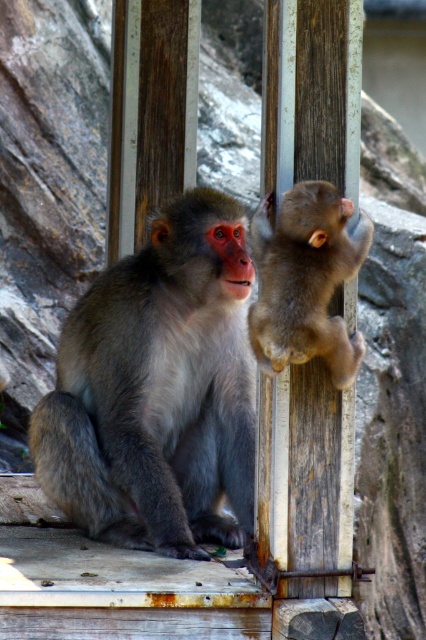
Question: Which point is farther to the camera?

Choices:
 (A) coord(74,506)
 (B) coord(308,275)

Answer: (A)

Question: Is gray fur monkey at center wider than brown furry monkey at upper right?

Choices:
 (A) no
 (B) yes

Answer: (B)

Question: Which of the following is the farthest from the observer?

Choices:
 (A) (69, 355)
 (B) (296, 275)

Answer: (A)

Question: Does gray fur monkey at center appear under brown furry monkey at upper right?

Choices:
 (A) no
 (B) yes

Answer: (B)

Question: In this image, where is gray fur monkey at center located relative to brown furry monkey at upper right?

Choices:
 (A) above
 (B) below

Answer: (B)